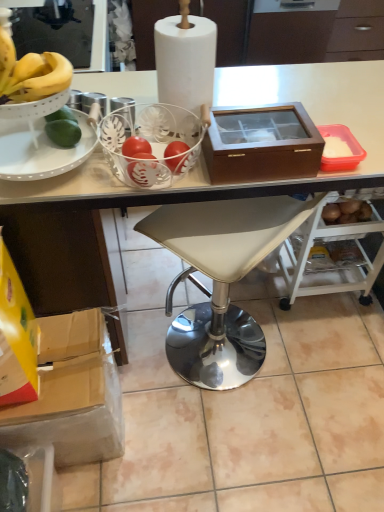
Where is `free spot behind white leather stool at center`? free spot behind white leather stool at center is located at coordinates (191, 298).